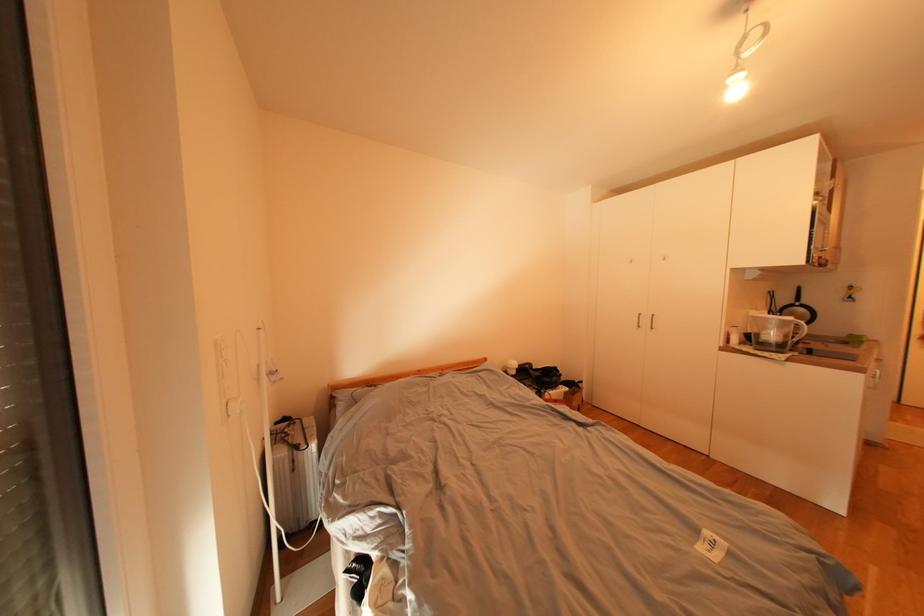
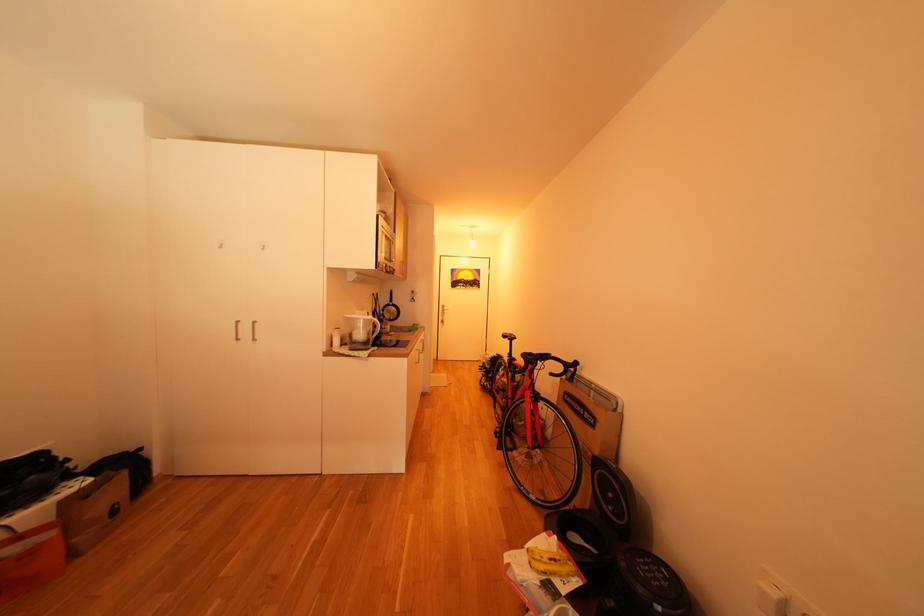
Question: How did the camera likely rotate?

Choices:
 (A) Left
 (B) Right
 (C) Up
 (D) Down

Answer: (B)